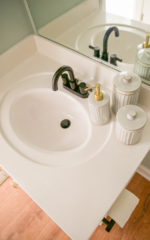
At what (x,y) coordinates should I click in order to perform the action: click on mirror. Please return your answer as a coordinate pair (x, y). Image resolution: width=150 pixels, height=240 pixels. Looking at the image, I should click on (96, 36).